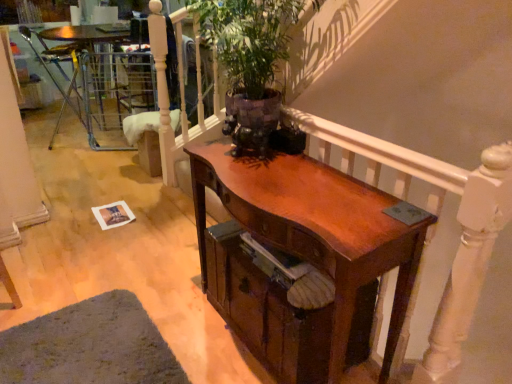
Question: Is wooden balustrade at upper center wider or thinner than metallic silver chair at left?

Choices:
 (A) wide
 (B) thin

Answer: (B)

Question: Is wooden balustrade at upper center in front of or behind metallic silver chair at left in the image?

Choices:
 (A) front
 (B) behind

Answer: (A)

Question: Which object is the farthest from the green leafy plant at upper center?

Choices:
 (A) shiny brown desk at center
 (B) metallic silver chair at left
 (C) wooden drawer at center
 (D) wooden balustrade at upper center

Answer: (B)

Question: Estimate the real-world distances between objects in this image. Which object is farther from the wooden drawer at center?

Choices:
 (A) green leafy plant at upper center
 (B) shiny brown desk at center
 (C) metallic silver chair at left
 (D) wooden balustrade at upper center

Answer: (C)